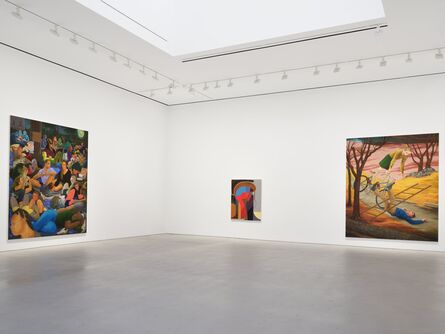
Where is `corner of small painting`? corner of small painting is located at coordinates pyautogui.click(x=231, y=179), pyautogui.click(x=260, y=177), pyautogui.click(x=261, y=220), pyautogui.click(x=230, y=219).